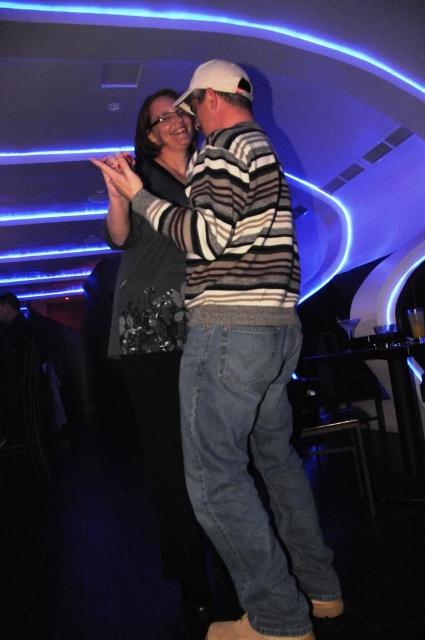
Who is lower down, striped sweater at center or shiny silver dress at center?

striped sweater at center is below.

Who is more forward, (x=220, y=349) or (x=144, y=141)?

Positioned in front is point (x=220, y=349).

This screenshot has height=640, width=425. What are the coordinates of `striped sweater at center` in the screenshot? It's located at (241, 358).